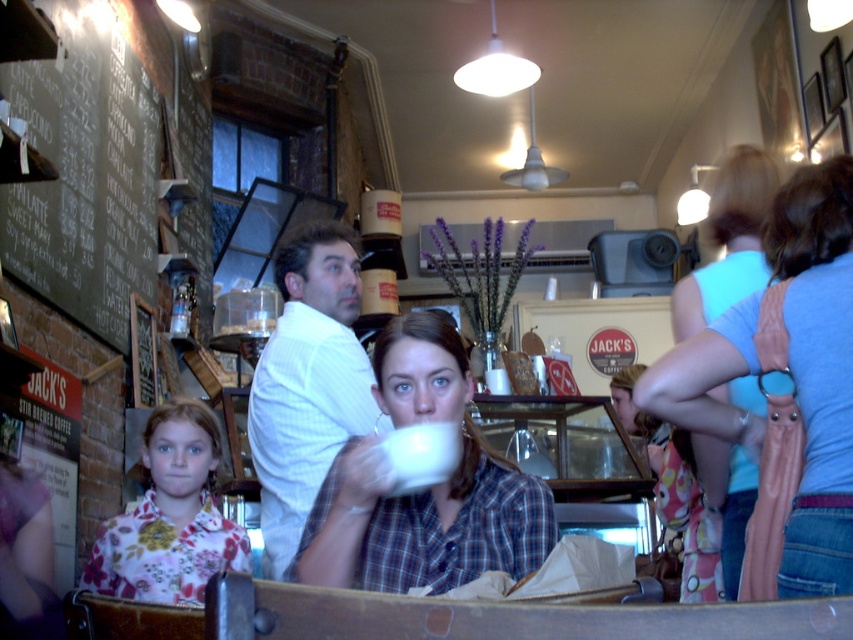
From the picture: You are a barista at Jacks cafe and need to place the light blue fabric purse at right and the matte white cup at center on a shelf that can only hold items up to 12 inches tall. The shelf currently has 10 inches of space. Can both items fit without exceeding the height limit?

The light blue fabric purse at right is taller than the matte white cup at center. Since the shelf has 10 inches of space and the purse is taller, if the purse is 11 inches and the cup is 9 inches, placing both would total 20 inches which exceeds the 12 inch limit. However, without exact measurements, we can only confirm that the taller item alone must not exceed 12 inches. The safest way is to place only the shorter item or ensure the tallest item is within the limit.

Consider the image. You are a barista at Jacks cafe and you need to place a new menu board. The menu board is 1 meter tall. The menu board must be placed so that it is below the matte white cup at center and above the floral fabric shirt at lower left. Is this possible?

The matte white cup at center is above the floral fabric shirt at lower left. Since the menu board is 1 meter tall, and the vertical space between them must accommodate its height, it depends on the actual distance between the cup and the shirt. However, based on the given information, we cannot determine if the space is sufficient. Please provide more details about the vertical distance between the two objects.